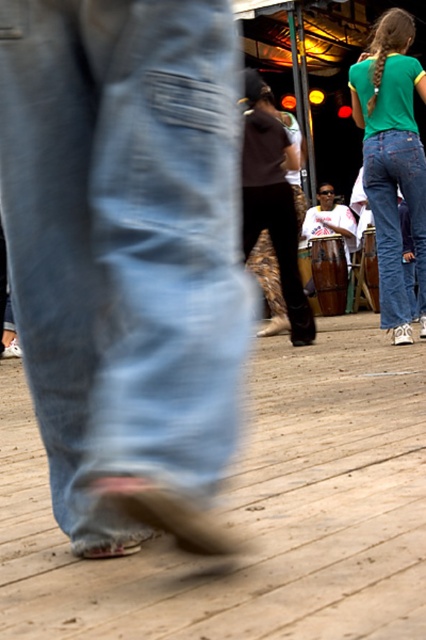
Is the position of denim jeans at upper right less distant than that of white matte drum at center?

Yes, it is.

Can you confirm if denim jeans at upper right is positioned above white matte drum at center?

No, denim jeans at upper right is not above white matte drum at center.

Is point (406, 320) positioned after point (333, 220)?

No, (406, 320) is in front of (333, 220).

Locate an element on the screen. denim jeans at upper right is located at coordinates (396, 216).

Who is more distant from viewer, (210, 301) or (371, 156)?

Point (371, 156)

Where is `denim jeans at lower left`? The image size is (426, 640). denim jeans at lower left is located at coordinates (127, 256).

Is camouflage pants at center to the right of denim jeans at upper right from the viewer's perspective?

Incorrect, camouflage pants at center is not on the right side of denim jeans at upper right.

Who is shorter, camouflage pants at center or denim jeans at upper right?

With less height is denim jeans at upper right.

This screenshot has width=426, height=640. I want to click on camouflage pants at center, so click(x=273, y=202).